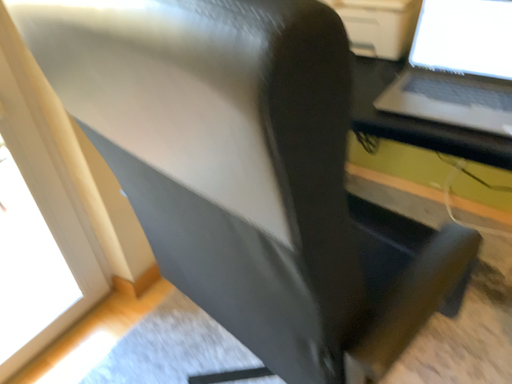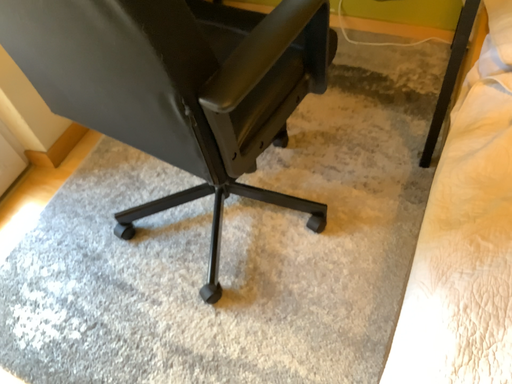
Question: Which way did the camera rotate in the video?

Choices:
 (A) rotated left
 (B) rotated right

Answer: (B)